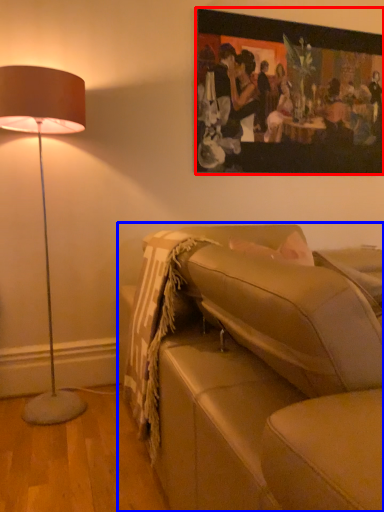
Question: Which object is closer to the camera taking this photo, picture frame (highlighted by a red box) or studio couch (highlighted by a blue box)?

Choices:
 (A) picture frame
 (B) studio couch

Answer: (B)